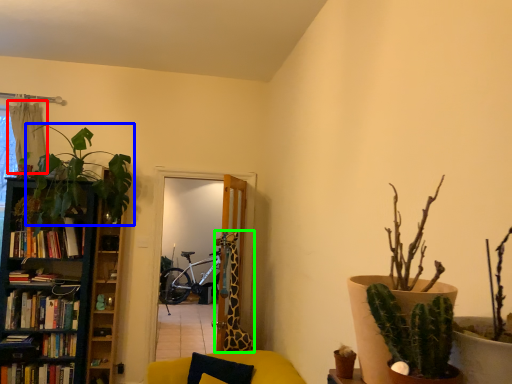
Question: Which is farther away from curtain (highlighted by a red box)? houseplant (highlighted by a blue box) or giraffe (highlighted by a green box)?

Choices:
 (A) houseplant
 (B) giraffe

Answer: (B)